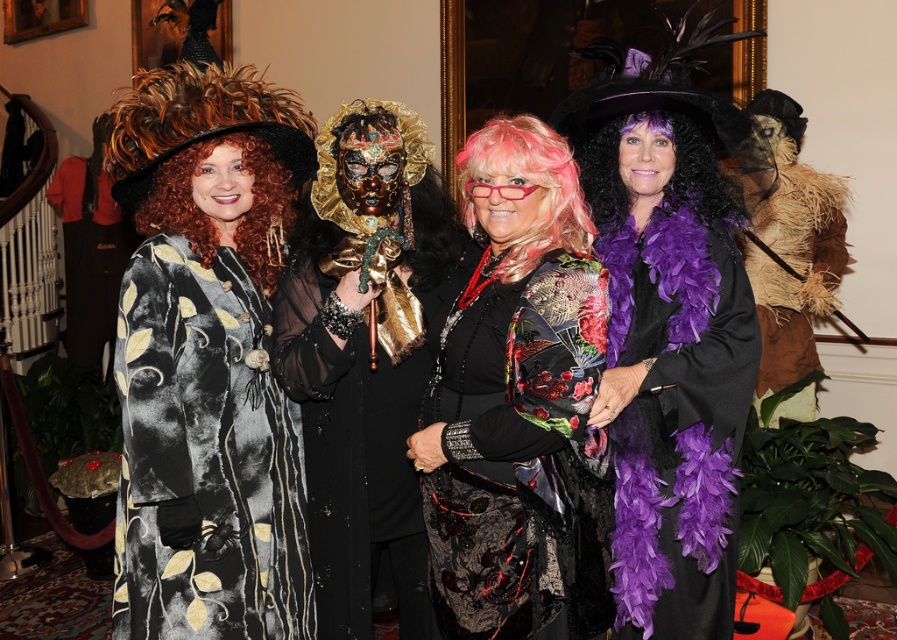
What do you see at coordinates (668, 332) in the screenshot? The height and width of the screenshot is (640, 897). I see `purple feather boa at right` at bounding box center [668, 332].

Looking at this image, is purple feather boa at right closer to the viewer compared to shiny black dress at center?

That is False.

Is point (640, 541) positioned behind point (586, 305)?

Yes.

Image resolution: width=897 pixels, height=640 pixels. Find the location of `purple feather boa at right`. purple feather boa at right is located at coordinates (668, 332).

Is curly red hair at center wider than purple feather boa at center?

No, curly red hair at center is not wider than purple feather boa at center.

Is point (257, 273) in front of point (588, 180)?

Yes.

Between point (247, 145) and point (719, 173), which one is positioned in front?

Positioned in front is point (247, 145).

This screenshot has width=897, height=640. What are the coordinates of `curly red hair at center` in the screenshot? It's located at (242, 212).

Between gold metallic mask at center and pink feathered wig at center, which one has less height?

pink feathered wig at center is shorter.

The height and width of the screenshot is (640, 897). Identify the location of gold metallic mask at center. (364, 356).